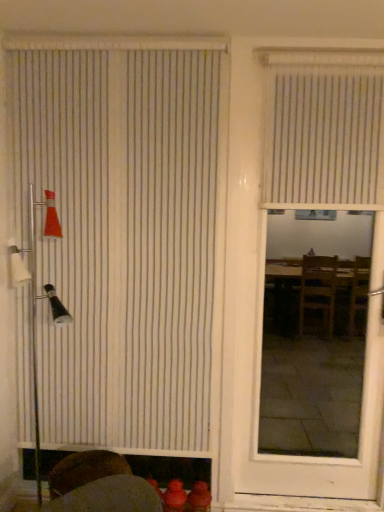
Question: Can you confirm if white matte door at center is positioned to the left of white vertical blinds at left, the 2th window blind positioned from the right?

Choices:
 (A) no
 (B) yes

Answer: (A)

Question: Is white matte door at center positioned beyond the bounds of white vertical blinds at left, which ranks as the first window blind in left-to-right order?

Choices:
 (A) no
 (B) yes

Answer: (B)

Question: Does white matte door at center have a smaller size compared to white vertical blinds at left, which ranks as the first window blind in left-to-right order?

Choices:
 (A) yes
 (B) no

Answer: (B)

Question: From the image's perspective, does white matte door at center appear lower than white vertical blinds at left, the 2th window blind positioned from the right?

Choices:
 (A) yes
 (B) no

Answer: (A)

Question: Can you confirm if white matte door at center is taller than white vertical blinds at left, which ranks as the first window blind in left-to-right order?

Choices:
 (A) no
 (B) yes

Answer: (A)

Question: Considering the relative sizes of white matte door at center and white vertical blinds at left, which ranks as the first window blind in left-to-right order, in the image provided, is white matte door at center wider than white vertical blinds at left, which ranks as the first window blind in left-to-right order,?

Choices:
 (A) yes
 (B) no

Answer: (A)

Question: Does white matte door at center turn towards white vertical blinds at upper right, the 2th window blind positioned from the left?

Choices:
 (A) yes
 (B) no

Answer: (A)

Question: Is white matte door at center to the right of white vertical blinds at upper right, arranged as the first window blind when viewed from the right, from the viewer's perspective?

Choices:
 (A) yes
 (B) no

Answer: (B)

Question: Is white matte door at center behind white vertical blinds at upper right, the 2th window blind positioned from the left?

Choices:
 (A) yes
 (B) no

Answer: (B)

Question: Does white matte door at center have a greater width compared to white vertical blinds at upper right, arranged as the first window blind when viewed from the right?

Choices:
 (A) no
 (B) yes

Answer: (B)

Question: Is white matte door at center in contact with white vertical blinds at upper right, arranged as the first window blind when viewed from the right?

Choices:
 (A) yes
 (B) no

Answer: (B)

Question: Is white matte door at center closer to camera compared to white vertical blinds at upper right, the 2th window blind positioned from the left?

Choices:
 (A) yes
 (B) no

Answer: (A)

Question: Is white vertical blinds at upper right, arranged as the first window blind when viewed from the right, turned away from white vertical blinds at left, the 2th window blind positioned from the right?

Choices:
 (A) no
 (B) yes

Answer: (A)